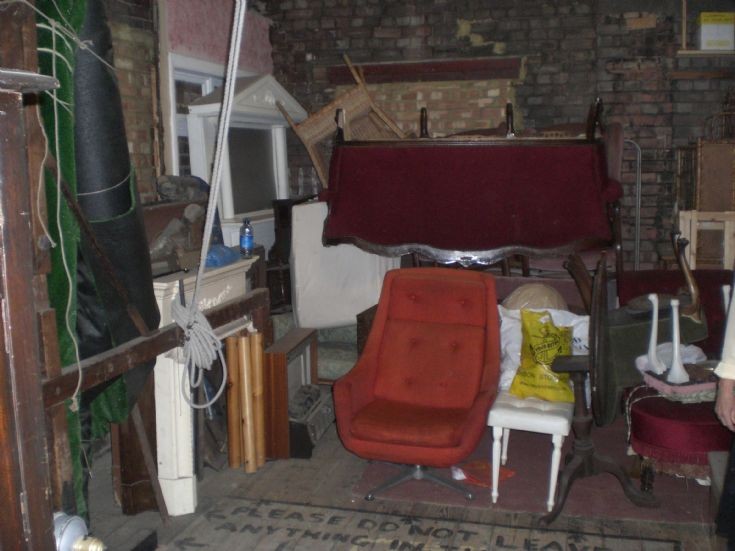
This screenshot has height=551, width=735. I want to click on maroon ottoman on the right, so click(x=659, y=434).